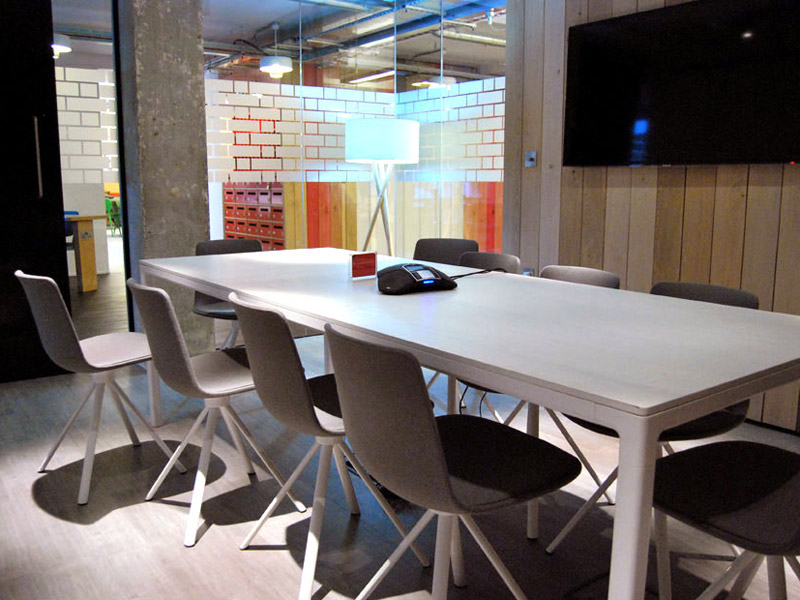
Where is `chair at the top of the table`? Image resolution: width=800 pixels, height=600 pixels. chair at the top of the table is located at coordinates (238, 241).